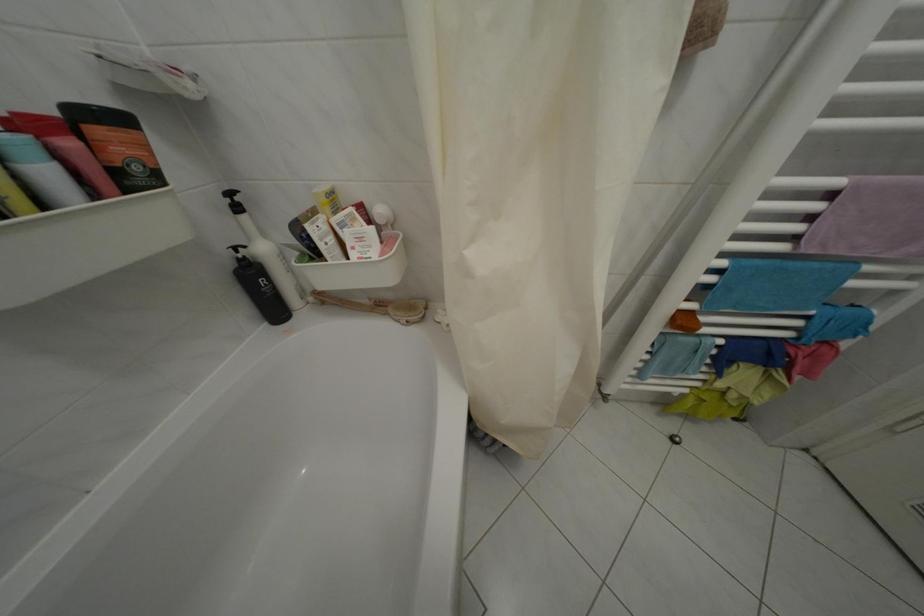
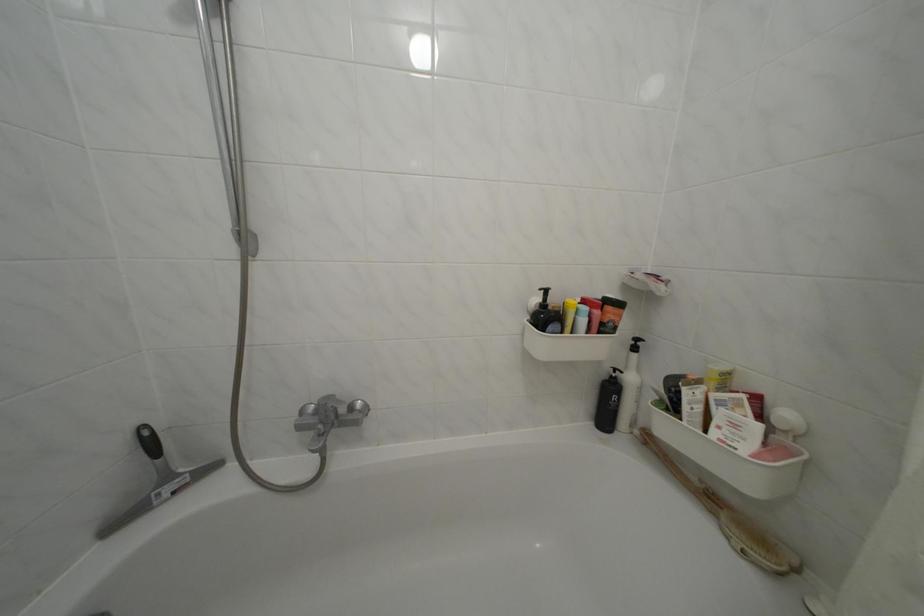
Where in the second image is the point corresponding to (320,305) from the first image?

(646, 438)